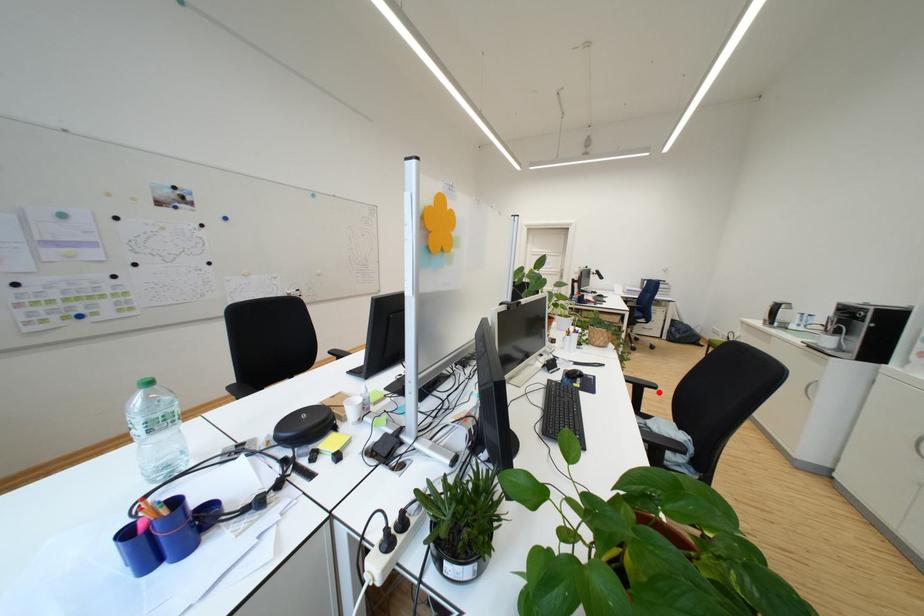
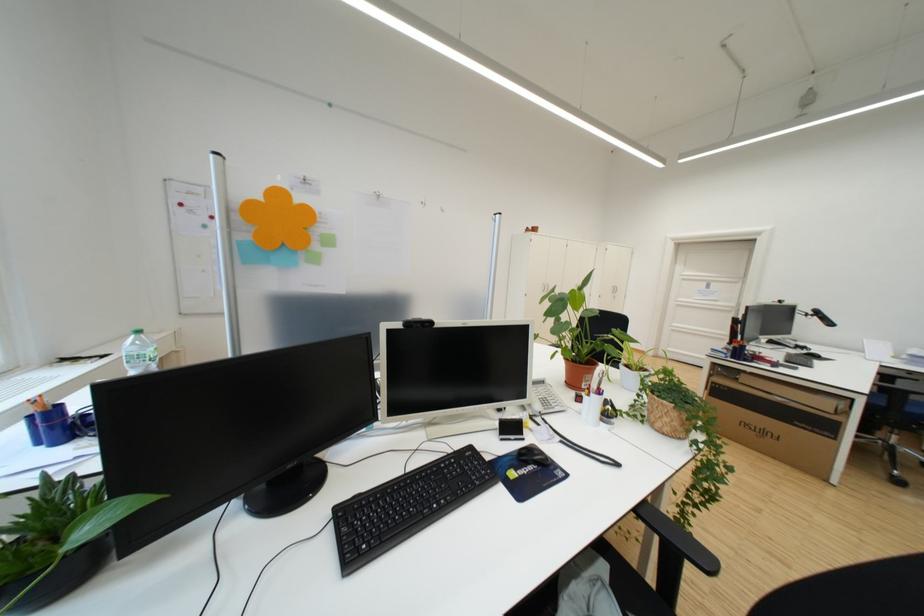
Find the pixel in the second image that matches the highlighted location in the first image.

(700, 567)